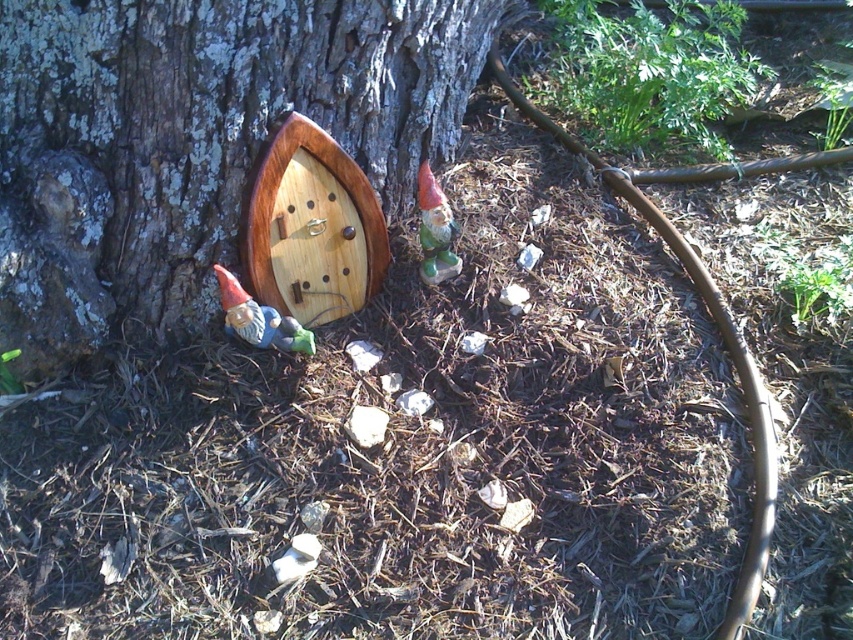
You are a child trying to place a tiny key into the lock of the miniature door on the smooth bark tree at center. Can you reach the lock if you are standing next to the matte ceramic gnome at lower left?

The smooth bark tree at center is bigger than the matte ceramic gnome at lower left, so the lock on the smooth bark tree at center may be too high for a child to reach while standing next to the matte ceramic gnome at lower left.

From the picture: You are a tiny creature exploring this garden. You see the smooth bark tree at center and the green matte gnome at center. Which object is positioned to the right from your perspective?

The green matte gnome at center is to the right of the smooth bark tree at center.